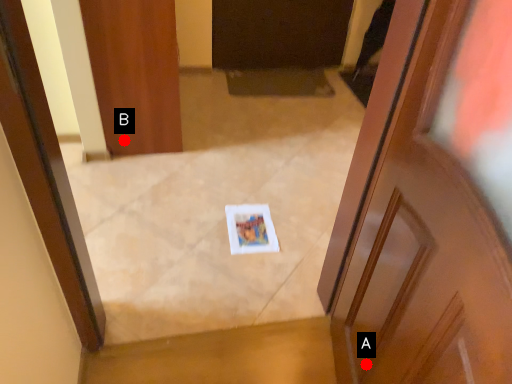
Question: Two points are circled on the image, labeled by A and B beside each circle. Which point is farther from the camera taking this photo?

Choices:
 (A) A is further
 (B) B is further

Answer: (B)